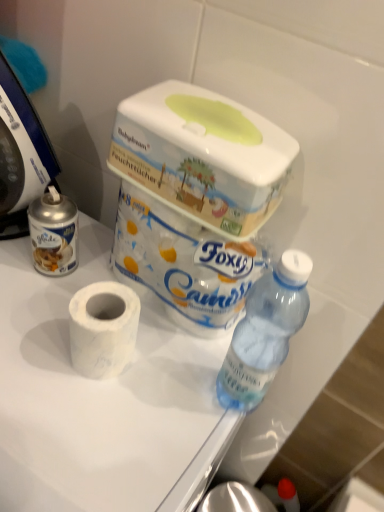
At what (x,y) coordinates should I click in order to perform the action: click on vacant position to the left of white matte toilet paper at center, which ranks as the second toilet paper in top-to-bottom order. Please return your answer as a coordinate pair (x, y). Image resolution: width=384 pixels, height=512 pixels. Looking at the image, I should click on (30, 323).